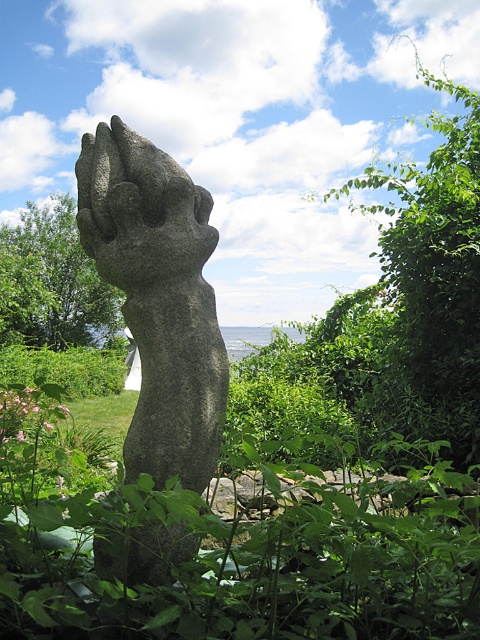
Can you confirm if gray stone hand at center is positioned above green leafy bush at center?

No.

Identify the location of gray stone hand at center. (157, 298).

Which is behind, point (180, 280) or point (25, 276)?

Point (25, 276)

The height and width of the screenshot is (640, 480). I want to click on gray stone hand at center, so click(157, 298).